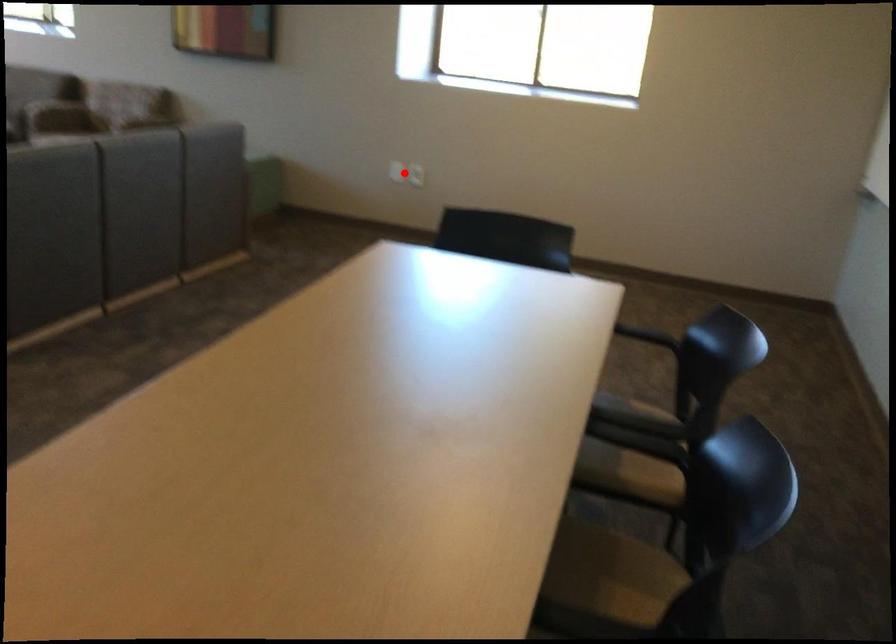
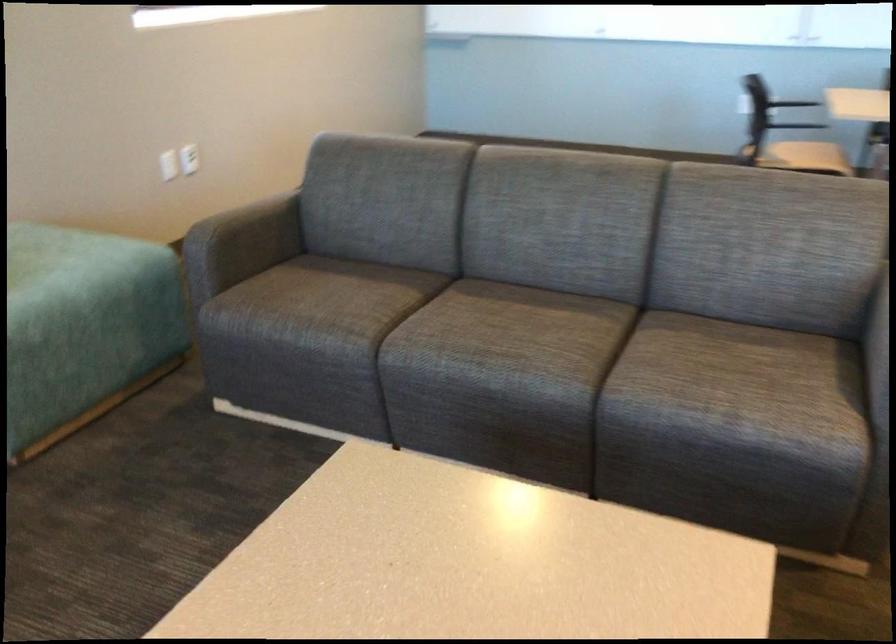
Find the pixel in the second image that matches the highlighted location in the first image.

(168, 165)